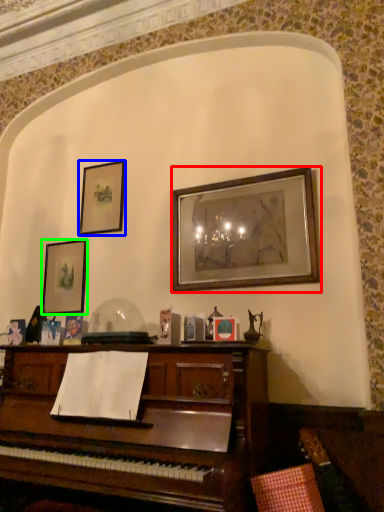
Question: Considering the real-world distances, which object is farthest from picture frame (highlighted by a red box)? picture frame (highlighted by a blue box) or picture frame (highlighted by a green box)?

Choices:
 (A) picture frame
 (B) picture frame

Answer: (B)